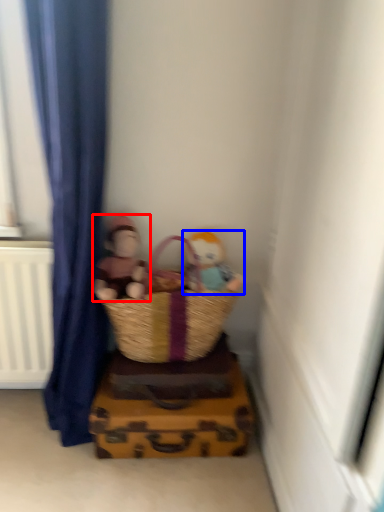
Question: Which point is further to the camera, person (highlighted by a red box) or person (highlighted by a blue box)?

Choices:
 (A) person
 (B) person

Answer: (B)